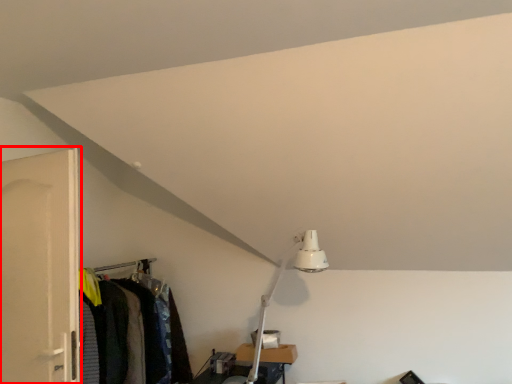
Question: Observing the image, what is the correct spatial positioning of door (annotated by the red box) in reference to closet?

Choices:
 (A) right
 (B) left

Answer: (B)